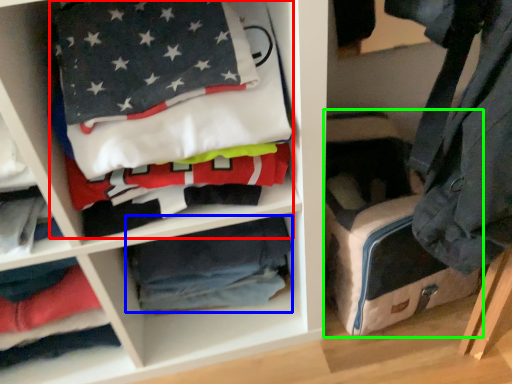
Question: Considering the real-world distances, which object is farthest from laundry (highlighted by a red box)? material (highlighted by a blue box) or pack (highlighted by a green box)?

Choices:
 (A) material
 (B) pack

Answer: (B)